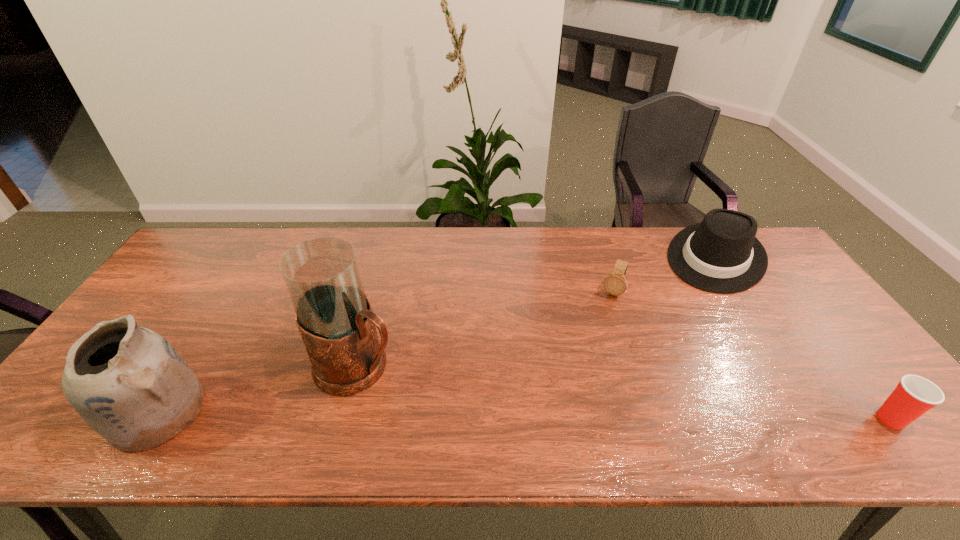
Find the location of `free space on the desktop that is between the leftmost object and the Dixie cup and is positioned on the face of the third object from left to right`. free space on the desktop that is between the leftmost object and the Dixie cup and is positioned on the face of the third object from left to right is located at coordinates (559, 416).

Locate an element on the screen. This screenshot has width=960, height=540. free space on the desktop that is between the leftmost object and the Dixie cup and is positioned with the handle on the side of the tallest object is located at coordinates (444, 415).

I want to click on free space on the desktop that is between the pottery and the Dixie cup and is positioned on the front-facing side of the fedora, so click(x=618, y=416).